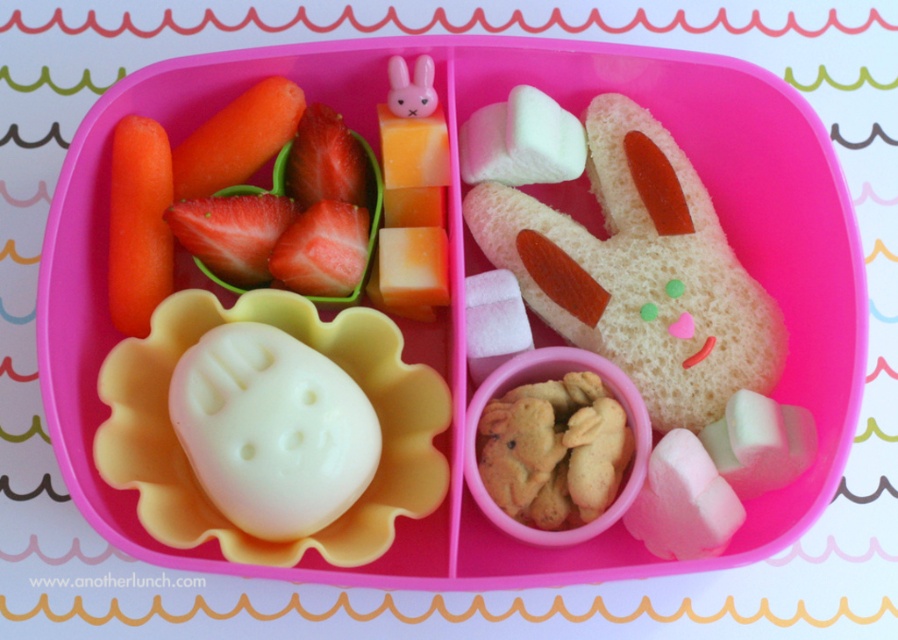
Question: Is red smooth strawberries at upper left to the left of orange smooth carrot at left from the viewer's perspective?

Choices:
 (A) yes
 (B) no

Answer: (B)

Question: Considering the relative positions of red smooth strawberries at upper left and orange smooth carrot at upper left in the image provided, where is red smooth strawberries at upper left located with respect to orange smooth carrot at upper left?

Choices:
 (A) below
 (B) above

Answer: (A)

Question: Among these points, which one is farthest from the camera?

Choices:
 (A) (225, 157)
 (B) (155, 243)
 (C) (365, 152)

Answer: (C)

Question: Is red smooth strawberries at upper left below orange smooth carrot at left?

Choices:
 (A) yes
 (B) no

Answer: (B)

Question: Which object is the farthest from the orange smooth carrot at upper left?

Choices:
 (A) red smooth strawberries at upper left
 (B) orange smooth carrot at left

Answer: (B)

Question: Which is farther from the red smooth strawberries at upper left?

Choices:
 (A) orange smooth carrot at upper left
 (B) orange smooth carrot at left

Answer: (B)